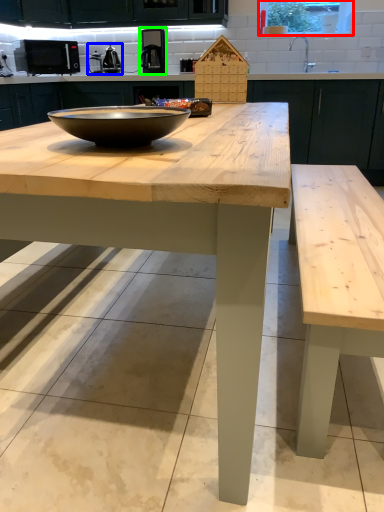
Question: Which object is the farthest from window screen (highlighted by a red box)? Choose among these: appliance (highlighted by a blue box) or coffee machine (highlighted by a green box).

Choices:
 (A) appliance
 (B) coffee machine

Answer: (A)